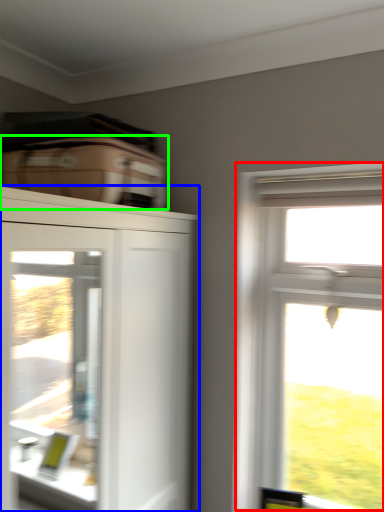
Question: Based on their relative distances, which object is farther from window (highlighted by a red box)? Choose from cupboard (highlighted by a blue box) and suitcase (highlighted by a green box).

Choices:
 (A) cupboard
 (B) suitcase

Answer: (A)